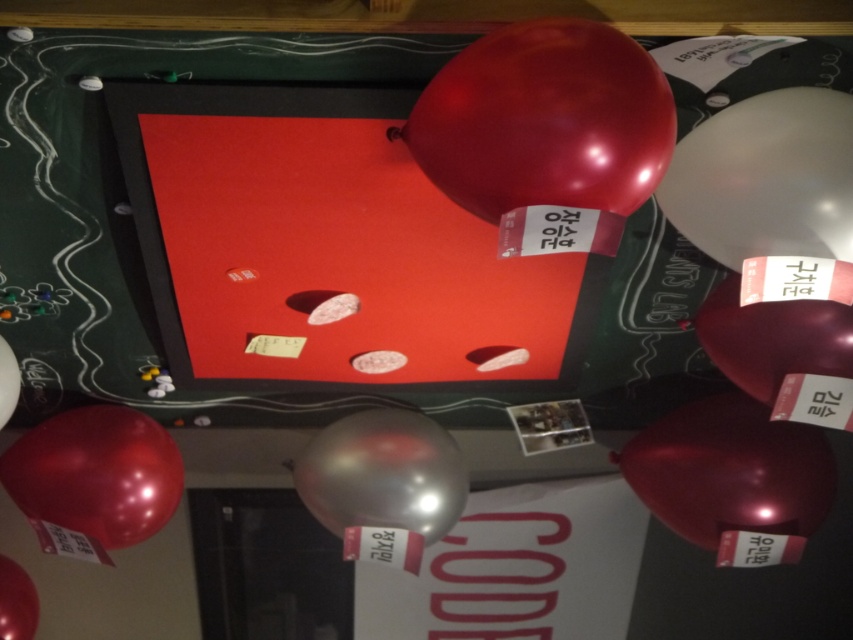
Question: Estimate the real-world distances between objects in this image. Which object is closer to the transparent metallic balloon at upper right?

Choices:
 (A) metallic silver balloon at center
 (B) metallic red balloon at right

Answer: (B)

Question: Does transparent metallic balloon at upper right appear over shiny metallic balloon at left?

Choices:
 (A) no
 (B) yes

Answer: (B)

Question: Is metallic silver balloon at center smaller than metallic red balloon at right?

Choices:
 (A) no
 (B) yes

Answer: (B)

Question: Does glossy red balloon at upper center have a smaller size compared to transparent metallic balloon at upper right?

Choices:
 (A) no
 (B) yes

Answer: (A)

Question: Which of the following is the closest to the observer?

Choices:
 (A) glossy metallic balloon at lower left
 (B) metallic silver balloon at center
 (C) glossy red balloon at upper center
 (D) shiny metallic balloon at left

Answer: (C)

Question: Which is nearer to the glossy metallic balloon at lower left?

Choices:
 (A) shiny metallic balloon at left
 (B) metallic red balloon at lower right
 (C) metallic silver balloon at center
 (D) shiny metallic balloon at lower left

Answer: (A)